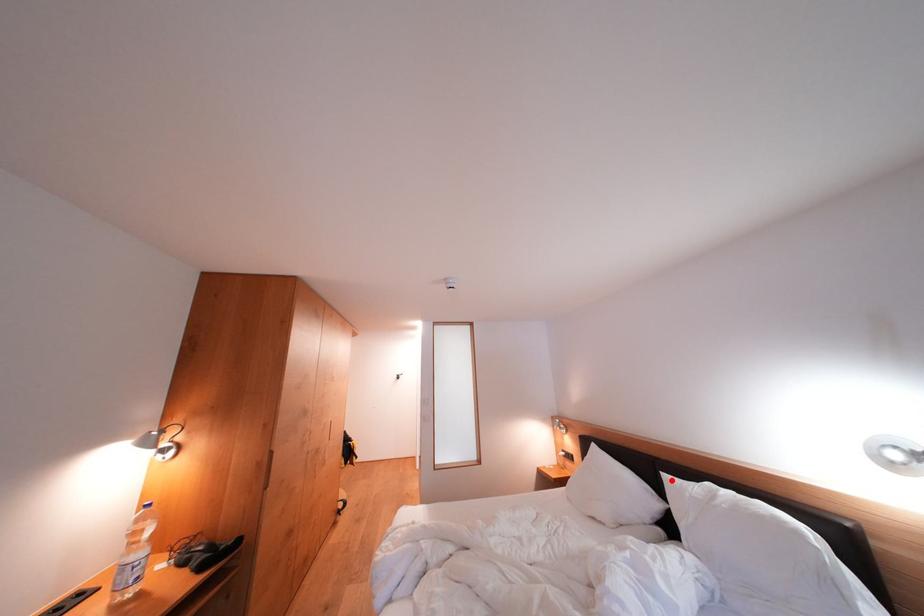
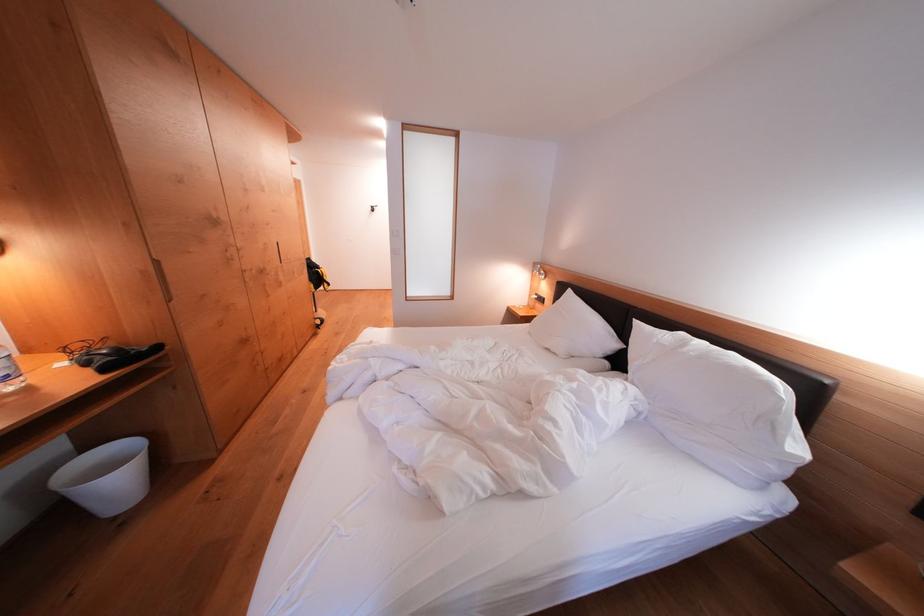
Find the pixel in the second image that matches the highlighted location in the first image.

(642, 326)